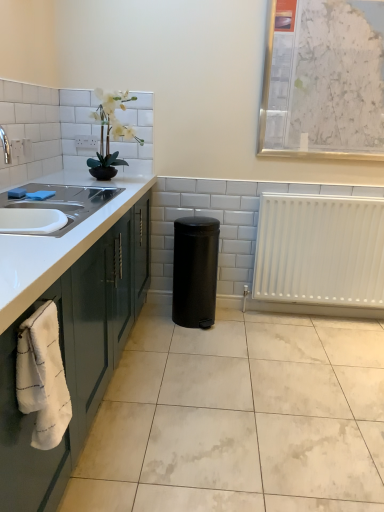
Locate an element on the screen. This screenshot has width=384, height=512. vacant space in white plastic radiator at lower right (from a real-world perspective) is located at coordinates (327, 314).